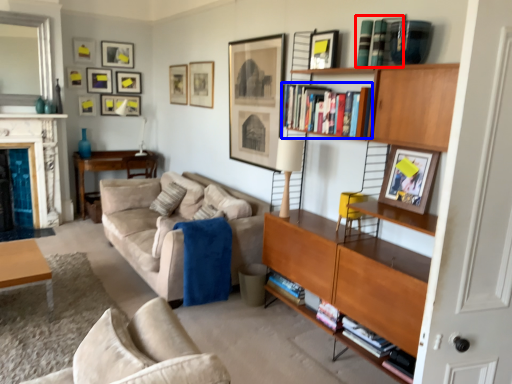
Question: Which object appears farthest to the camera in this image, book (highlighted by a red box) or book (highlighted by a blue box)?

Choices:
 (A) book
 (B) book

Answer: (B)